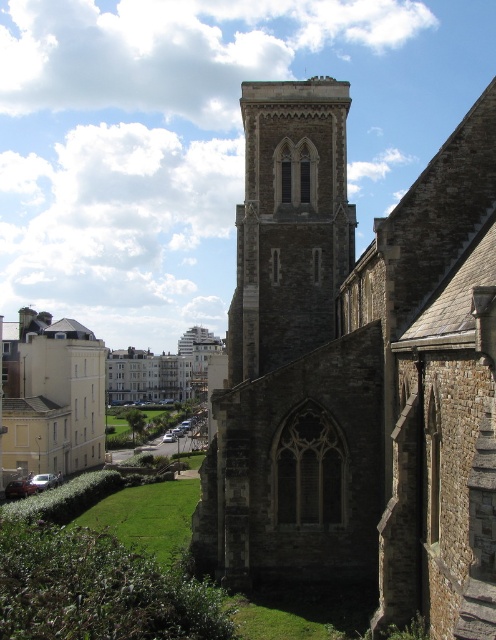
You are standing in front of the historic stone church and want to take a photo that includes both the stone gothic tower at center and the white stone building at left. Based on their positions, which one should you position on the left side of your photo?

The white stone building at left should be positioned on the left side of your photo since the stone gothic tower at center is to the right of it.

You are a tour guide leading a group to the historic stone church. You notice the stone gothic tower at center and the brown stone church at center. Your group wants to know if they can walk between them. Can they?

The distance between the brown stone church at center and the stone gothic tower at center is 7.06 meters, so yes, they can walk between them as the space is wide enough for a group to pass through comfortably.

You are standing at the entrance of the brown stone church at center. If you face the direction where the modern residential buildings are located, which direction should you turn to see the bell tower?

The brown stone church at center is located at point (359, 372). Since the bell tower is in the foreground and the modern residential buildings are to the left in the background, facing the modern buildings would mean turning left from the entrance. Therefore, to see the bell tower, you should turn right instead of left.